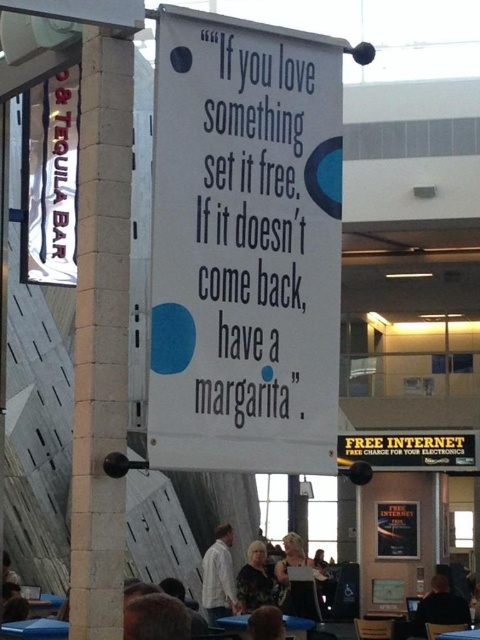
You are a photographer trying to capture both the white paper sign at center and the floral dress at center in a single frame. Which object should you focus on first to ensure both are in the frame without moving the camera?

Since the white paper sign at center has a smaller size compared to the floral dress at center, you should focus on the larger floral dress at center first to ensure both fit within the frame.

You are a photographer trying to capture a candid shot of the person wearing the white shirt at center and the person with the smooth skin head at lower center. Since you want to ensure both subjects are fully visible in the frame, which subject should you position closer to the camera to avoid cropping?

You should position the white shirt at center closer to the camera because it is taller than the smooth skin head at lower center, ensuring both subjects can be fully captured without cropping.

You are standing in the public space and want to find the Tequila Bar. You see the white paper sign at center. Based on its position, which direction should you walk to reach the Tequila Bar?

The white paper sign at center is located at point [244,246]. Since the Tequila Bar sign is in the background, you should walk towards the direction where the Tequila Bar sign is located, which is likely behind the white paper sign at center.